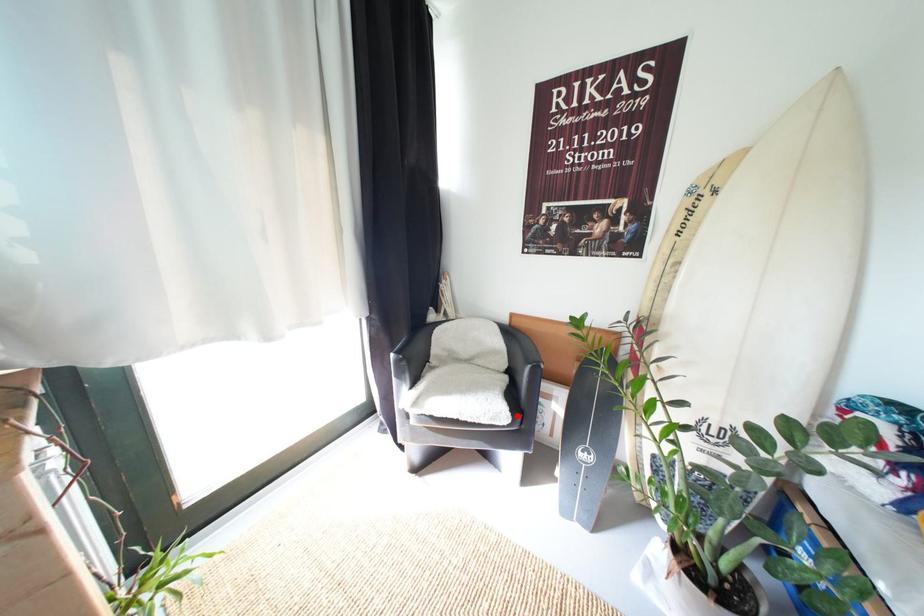
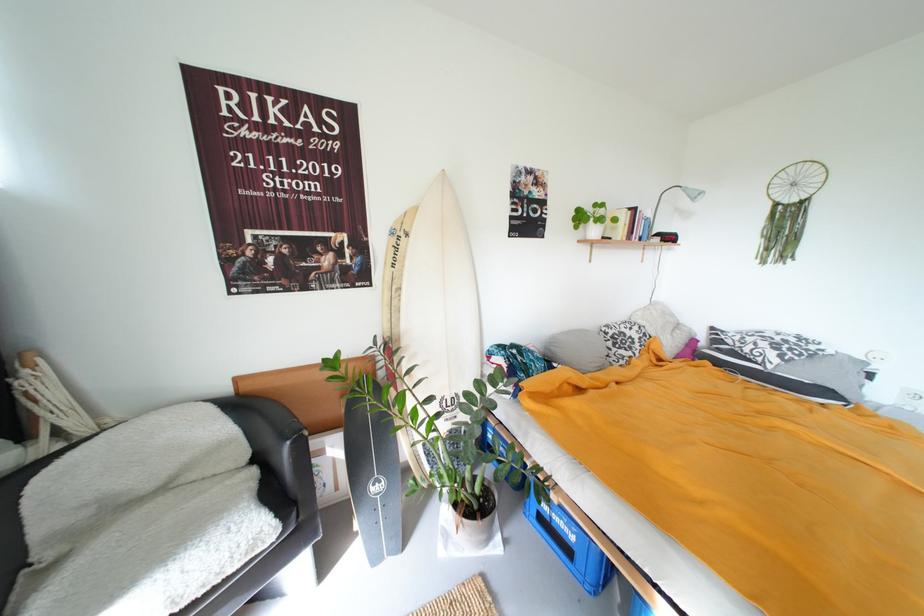
The point at the highlighted location is marked in the first image. Where is the corresponding point in the second image?

(284, 524)